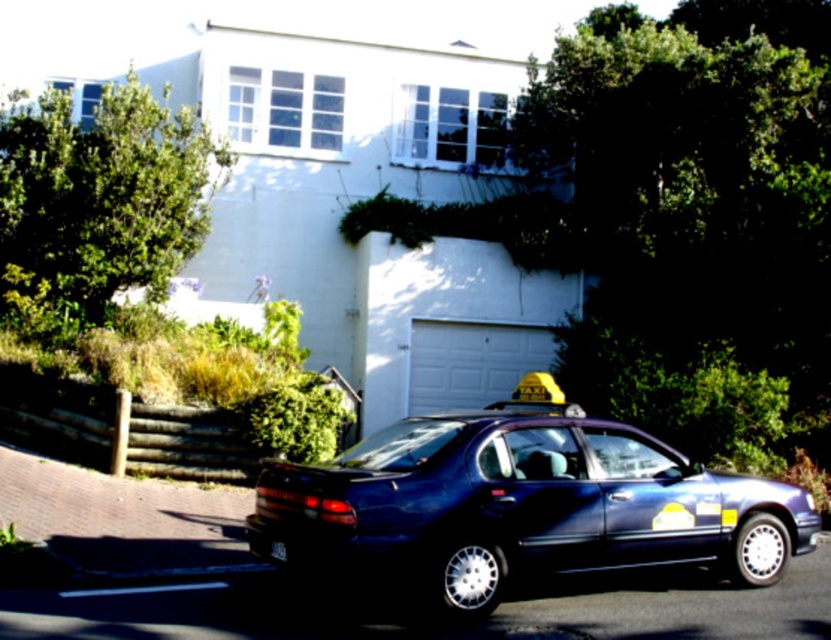
Question: Among these points, which one is nearest to the camera?

Choices:
 (A) (281, 547)
 (B) (529, 376)

Answer: (A)

Question: Does glossy blue sedan at center appear on the left side of yellow rubber taxi at center?

Choices:
 (A) yes
 (B) no

Answer: (A)

Question: Considering the relative positions of glossy blue sedan at center and yellow rubber taxi at center in the image provided, where is glossy blue sedan at center located with respect to yellow rubber taxi at center?

Choices:
 (A) below
 (B) above

Answer: (A)

Question: Is glossy blue sedan at center wider than yellow rubber taxi at center?

Choices:
 (A) yes
 (B) no

Answer: (A)

Question: Among these objects, which one is farthest from the camera?

Choices:
 (A) yellow rubber taxi at center
 (B) glossy blue sedan at center

Answer: (A)

Question: Which object is positioned farthest from the black plastic license plate at lower center?

Choices:
 (A) yellow rubber taxi at center
 (B) glossy blue sedan at center

Answer: (A)